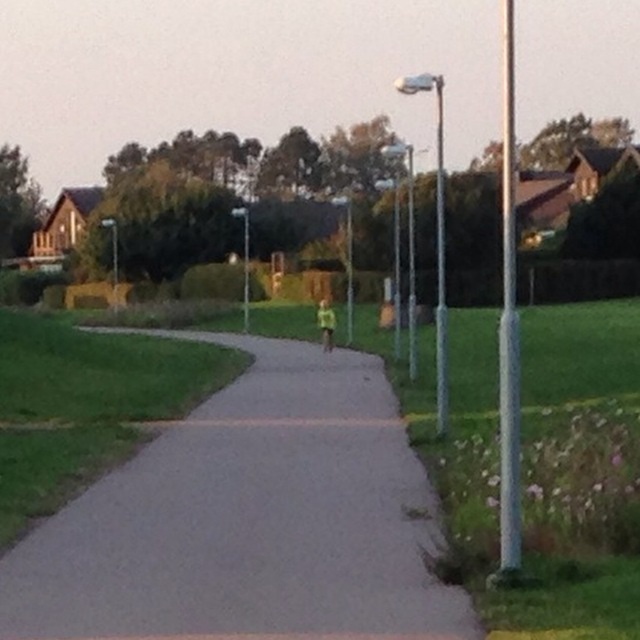
The height and width of the screenshot is (640, 640). Describe the element at coordinates (508, 328) in the screenshot. I see `silver metallic pole at right` at that location.

This screenshot has width=640, height=640. Find the location of `silver metallic pole at right`. silver metallic pole at right is located at coordinates (508, 328).

From the picture: Who is positioned more to the right, gray asphalt path at center or silver metallic pole at right?

silver metallic pole at right

Does gray asphalt path at center appear on the right side of silver metallic pole at right?

Incorrect, gray asphalt path at center is not on the right side of silver metallic pole at right.

The width and height of the screenshot is (640, 640). What do you see at coordinates (250, 518) in the screenshot?
I see `gray asphalt path at center` at bounding box center [250, 518].

Identify the location of gray asphalt path at center. This screenshot has height=640, width=640. (250, 518).

Describe the element at coordinates (508, 328) in the screenshot. This screenshot has height=640, width=640. I see `silver metallic pole at right` at that location.

Between point (513, 324) and point (436, 388), which one is positioned behind?

Positioned behind is point (436, 388).

Identify the location of silver metallic pole at right. (508, 328).